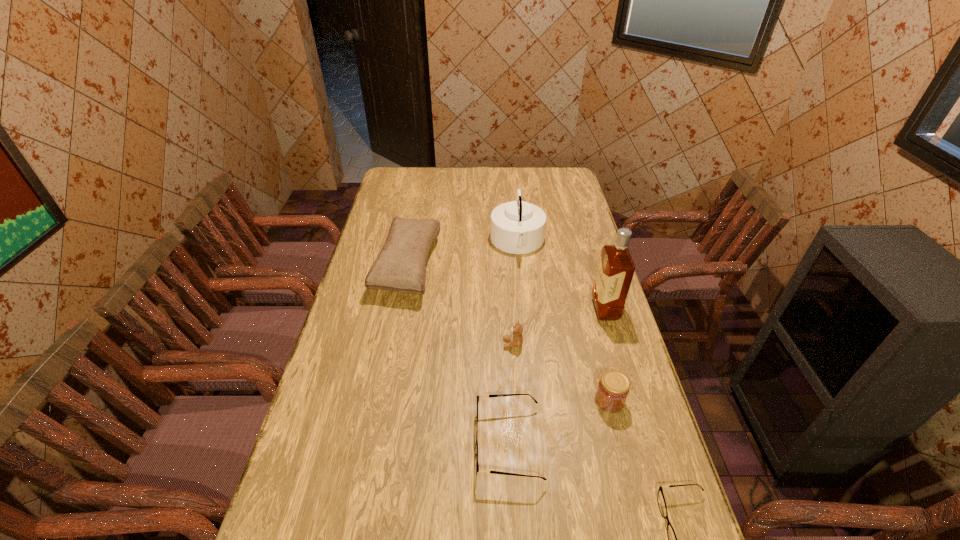
What are the coordinates of `the taller spectacles` in the screenshot? It's located at (497, 395).

You are a GUI agent. You are given a task and a screenshot of the screen. Output one action in this format:
    pyautogui.click(x=<x>, y=<y>)
    Task: Click on the second shortest object
    Image resolution: width=960 pixels, height=540 pixels.
    Given the screenshot: What is the action you would take?
    pyautogui.click(x=497, y=395)

I want to click on jam, so click(613, 388).

This screenshot has height=540, width=960. I want to click on the sixth shortest object, so click(517, 227).

The height and width of the screenshot is (540, 960). I want to click on the tallest object, so click(616, 268).

Locate an element on the screen. This screenshot has height=540, width=960. the third tallest object is located at coordinates (400, 266).

Locate an element on the screen. The image size is (960, 540). cushion is located at coordinates (400, 266).

You are a GUI agent. You are given a task and a screenshot of the screen. Output one action in this format:
    pyautogui.click(x=<x>, y=<y>)
    Task: Click on the fourth farthest object
    
    Given the screenshot: What is the action you would take?
    pyautogui.click(x=516, y=339)

Find the location of a particular element. Image resolution: width=960 pixels, height=540 pixels. free space located on the front-facing side of the second shortest object is located at coordinates pyautogui.click(x=422, y=444).

The width and height of the screenshot is (960, 540). Identify the location of free space located on the front-facing side of the second shortest object. (434, 444).